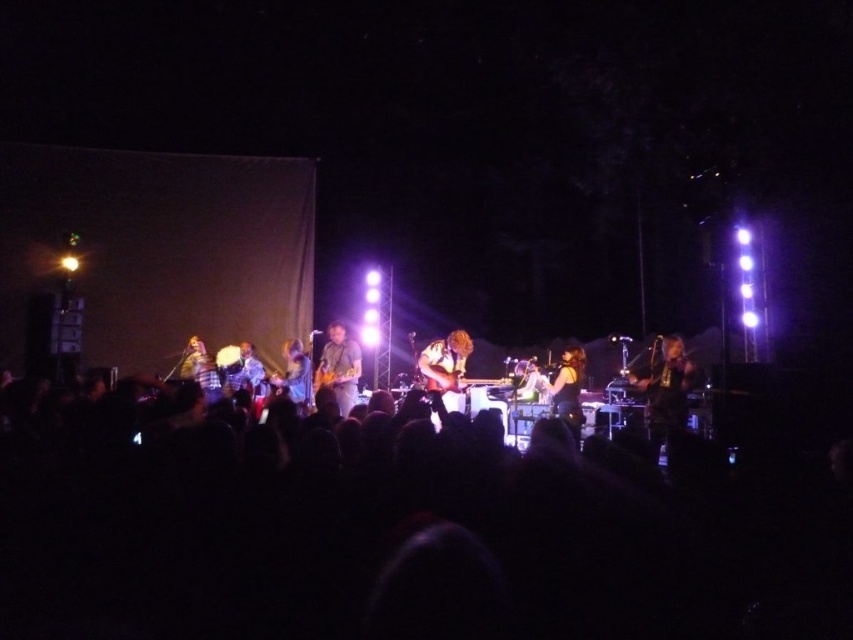
In the scene shown: You are a photographer standing at the center of the stage during the live music performance. You want to take a photo that includes both the point at (653, 419) and the point at (285, 349). Which point will appear closer to the camera in the photo?

Point (653, 419) is in front of point (285, 349), so it will appear closer to the camera in the photo.

You are a photographer at the concert venue and want to capture a closeup shot of the shiny black guitar at right. Based on its position, where should you aim your camera? Please provide coordinates in the format of a point like this example format for reference, but do not include any other details.

The shiny black guitar at right is located at point (x=665, y=392).

You are a stagehand who needs to move a 10 feet long ladder from the shiny black guitar at right to the light brown leather guitar at center. Can you safely move the ladder without it hitting anything in between?

The distance between the shiny black guitar at right and the light brown leather guitar at center is 8.86 feet. Since the ladder is 10 feet long, it is longer than the space available. Therefore, you cannot safely move the ladder without it hitting something in between.